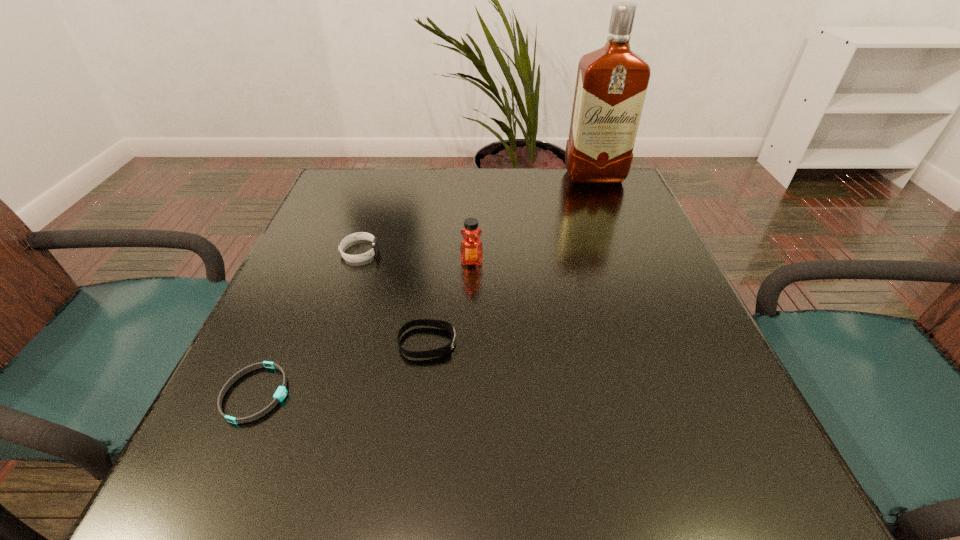
Locate an element on the screen. This screenshot has height=540, width=960. liquor is located at coordinates (611, 85).

Locate an element on the screen. The image size is (960, 540). the farthest object is located at coordinates (611, 85).

Find the location of a particular element. This screenshot has width=960, height=540. honey is located at coordinates (471, 248).

Where is `the fourth shortest object`? This screenshot has height=540, width=960. the fourth shortest object is located at coordinates (471, 248).

Find the location of `the third shortest object`. the third shortest object is located at coordinates (353, 237).

What are the coordinates of `the tallest wristband` in the screenshot? It's located at (353, 237).

Where is `the third object from right to left`? This screenshot has width=960, height=540. the third object from right to left is located at coordinates (445, 350).

Find the location of a particular element. The image size is (960, 540). the second shortest object is located at coordinates (445, 350).

The height and width of the screenshot is (540, 960). What are the coordinates of `the nearest wristband` in the screenshot? It's located at (280, 394).

You are a GUI agent. You are given a task and a screenshot of the screen. Output one action in this format:
    pyautogui.click(x=<x>, y=<y>)
    Task: Click on the shortest object
    This screenshot has width=960, height=540.
    Given the screenshot: What is the action you would take?
    pyautogui.click(x=280, y=394)